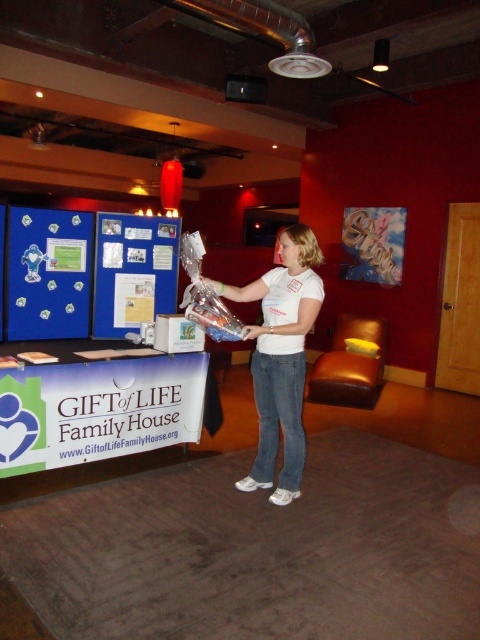
Does white matte shirt at center have a lesser width compared to blue fabric bulletin board at center?

In fact, white matte shirt at center might be wider than blue fabric bulletin board at center.

Locate an element on the screen. This screenshot has height=640, width=480. white matte shirt at center is located at coordinates (280, 356).

Find the location of a particular element. The image size is (480, 640). white matte shirt at center is located at coordinates (280, 356).